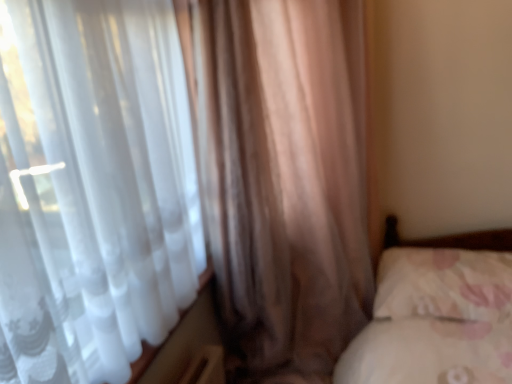
This screenshot has height=384, width=512. What do you see at coordinates (444, 284) in the screenshot?
I see `fluffy white pillow at lower right` at bounding box center [444, 284].

The height and width of the screenshot is (384, 512). What are the coordinates of `satin brown curtain at left, placed as the 1th curtain when sorted from left to right` in the screenshot? It's located at (285, 180).

From the picture: Is satin brown curtain at left, the second curtain positioned from the right, wider than translucent fabric curtain at left, the first curtain when ordered from right to left?

Yes, satin brown curtain at left, the second curtain positioned from the right, is wider than translucent fabric curtain at left, the first curtain when ordered from right to left.

In the scene shown: Considering the relative positions of satin brown curtain at left, placed as the 1th curtain when sorted from left to right, and translucent fabric curtain at left, the first curtain when ordered from right to left, in the image provided, is satin brown curtain at left, placed as the 1th curtain when sorted from left to right, to the right of translucent fabric curtain at left, the first curtain when ordered from right to left, from the viewer's perspective?

Incorrect, satin brown curtain at left, placed as the 1th curtain when sorted from left to right, is not on the right side of translucent fabric curtain at left, the first curtain when ordered from right to left.

Is satin brown curtain at left, the second curtain positioned from the right, bigger or smaller than translucent fabric curtain at left, the 2th curtain viewed from the left?

Clearly, satin brown curtain at left, the second curtain positioned from the right, is larger in size than translucent fabric curtain at left, the 2th curtain viewed from the left.

Is satin brown curtain at left, the second curtain positioned from the right, placed right next to translucent fabric curtain at left, the first curtain when ordered from right to left?

No.

Which object is positioned more to the left, translucent fabric curtain at left, the first curtain when ordered from right to left, or fluffy white pillow at lower right?

Positioned to the left is translucent fabric curtain at left, the first curtain when ordered from right to left.

Which is correct: translucent fabric curtain at left, the 2th curtain viewed from the left, is inside fluffy white pillow at lower right, or outside of it?

translucent fabric curtain at left, the 2th curtain viewed from the left, is spatially situated outside fluffy white pillow at lower right.

Find the location of a particular element. curtain that is the 1st one when counting leftward from the fluffy white pillow at lower right is located at coordinates (98, 190).

Is point (60, 366) closer to viewer compared to point (406, 308)?

Yes, it is.

Is translucent fabric curtain at left, the first curtain when ordered from right to left, facing towards satin brown curtain at left, placed as the 1th curtain when sorted from left to right?

Yes, translucent fabric curtain at left, the first curtain when ordered from right to left, is turned towards satin brown curtain at left, placed as the 1th curtain when sorted from left to right.

From the image's perspective, between translucent fabric curtain at left, the first curtain when ordered from right to left, and satin brown curtain at left, the second curtain positioned from the right, who is located below?

translucent fabric curtain at left, the first curtain when ordered from right to left, appears lower in the image.

Is translucent fabric curtain at left, the 2th curtain viewed from the left, at the left side of satin brown curtain at left, the second curtain positioned from the right?

No.

Is translucent fabric curtain at left, the first curtain when ordered from right to left, bigger than satin brown curtain at left, placed as the 1th curtain when sorted from left to right?

No.

From the image's perspective, is fluffy white pillow at lower right below satin brown curtain at left, placed as the 1th curtain when sorted from left to right?

Yes, from the image's perspective, fluffy white pillow at lower right is beneath satin brown curtain at left, placed as the 1th curtain when sorted from left to right.

Is fluffy white pillow at lower right facing towards satin brown curtain at left, the second curtain positioned from the right?

Yes.

Would you say fluffy white pillow at lower right is to the left or to the right of satin brown curtain at left, placed as the 1th curtain when sorted from left to right, in the picture?

Clearly, fluffy white pillow at lower right is on the right of satin brown curtain at left, placed as the 1th curtain when sorted from left to right, in the image.

Does fluffy white pillow at lower right have a larger size compared to satin brown curtain at left, placed as the 1th curtain when sorted from left to right?

Actually, fluffy white pillow at lower right might be smaller than satin brown curtain at left, placed as the 1th curtain when sorted from left to right.

Is satin brown curtain at left, the second curtain positioned from the right, beside fluffy white pillow at lower right?

No, satin brown curtain at left, the second curtain positioned from the right, is not making contact with fluffy white pillow at lower right.

Does satin brown curtain at left, placed as the 1th curtain when sorted from left to right, appear on the right side of fluffy white pillow at lower right?

No.

In terms of width, does satin brown curtain at left, the second curtain positioned from the right, look wider or thinner when compared to fluffy white pillow at lower right?

satin brown curtain at left, the second curtain positioned from the right, is wider than fluffy white pillow at lower right.

Which is nearer, (306, 323) or (409, 289)?

Clearly, point (306, 323) is more distant from the camera than point (409, 289).

Considering the positions of objects fluffy white pillow at lower right and translucent fabric curtain at left, the 2th curtain viewed from the left, in the image provided, who is in front, fluffy white pillow at lower right or translucent fabric curtain at left, the 2th curtain viewed from the left,?

translucent fabric curtain at left, the 2th curtain viewed from the left.

Who is bigger, fluffy white pillow at lower right or translucent fabric curtain at left, the first curtain when ordered from right to left?

translucent fabric curtain at left, the first curtain when ordered from right to left.

Is translucent fabric curtain at left, the first curtain when ordered from right to left, surrounded by fluffy white pillow at lower right?

That's incorrect, translucent fabric curtain at left, the first curtain when ordered from right to left, is not inside fluffy white pillow at lower right.

From the image's perspective, is fluffy white pillow at lower right located above or below translucent fabric curtain at left, the 2th curtain viewed from the left?

From the image's perspective, fluffy white pillow at lower right appears below translucent fabric curtain at left, the 2th curtain viewed from the left.

Find the location of a particular element. The height and width of the screenshot is (384, 512). curtain behind the translucent fabric curtain at left, the first curtain when ordered from right to left is located at coordinates (285, 180).

From the fluffy white pillow at lower right, count 2nd curtains forward and point to it. Please provide its 2D coordinates.

[(98, 190)]

Considering their positions, is satin brown curtain at left, the second curtain positioned from the right, positioned further to fluffy white pillow at lower right than translucent fabric curtain at left, the 2th curtain viewed from the left?

translucent fabric curtain at left, the 2th curtain viewed from the left, is positioned further to the anchor fluffy white pillow at lower right.

Looking at the image, which one is located further to satin brown curtain at left, the second curtain positioned from the right, translucent fabric curtain at left, the 2th curtain viewed from the left, or fluffy white pillow at lower right?

fluffy white pillow at lower right lies further to satin brown curtain at left, the second curtain positioned from the right, than the other object.

Estimate the real-world distances between objects in this image. Which object is further from translucent fabric curtain at left, the 2th curtain viewed from the left, fluffy white pillow at lower right or satin brown curtain at left, the second curtain positioned from the right?

Based on the image, fluffy white pillow at lower right appears to be further to translucent fabric curtain at left, the 2th curtain viewed from the left.

Estimate the real-world distances between objects in this image. Which object is further from satin brown curtain at left, placed as the 1th curtain when sorted from left to right, fluffy white pillow at lower right or translucent fabric curtain at left, the 2th curtain viewed from the left?

Among the two, fluffy white pillow at lower right is located further to satin brown curtain at left, placed as the 1th curtain when sorted from left to right.

Based on their spatial positions, is translucent fabric curtain at left, the first curtain when ordered from right to left, or satin brown curtain at left, the second curtain positioned from the right, closer to fluffy white pillow at lower right?

Based on the image, satin brown curtain at left, the second curtain positioned from the right, appears to be nearer to fluffy white pillow at lower right.

From the image, which object appears to be farther from translucent fabric curtain at left, the 2th curtain viewed from the left, satin brown curtain at left, placed as the 1th curtain when sorted from left to right, or fluffy white pillow at lower right?

fluffy white pillow at lower right is positioned further to the anchor translucent fabric curtain at left, the 2th curtain viewed from the left.

Find the location of a particular element. curtain positioned between translucent fabric curtain at left, the first curtain when ordered from right to left, and fluffy white pillow at lower right from near to far is located at coordinates (285, 180).